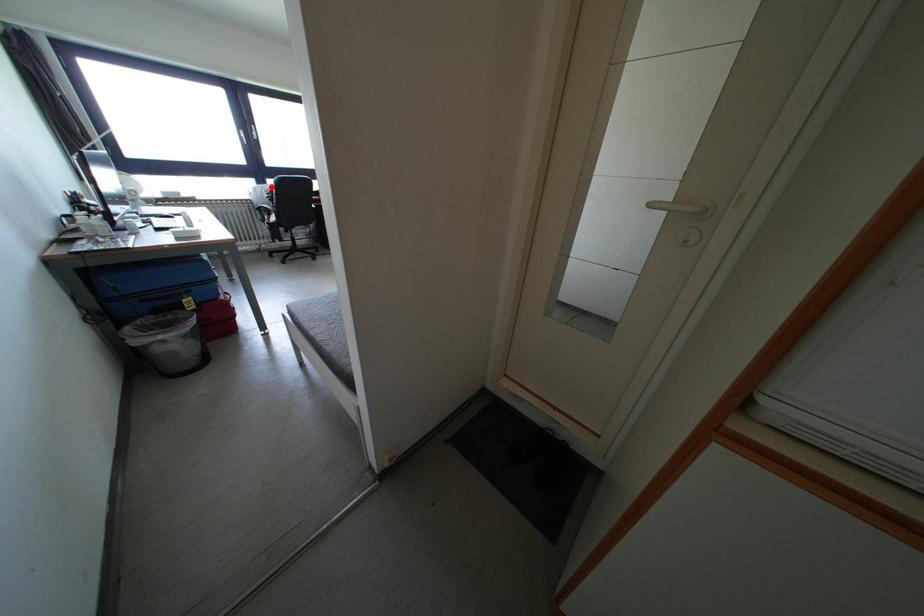
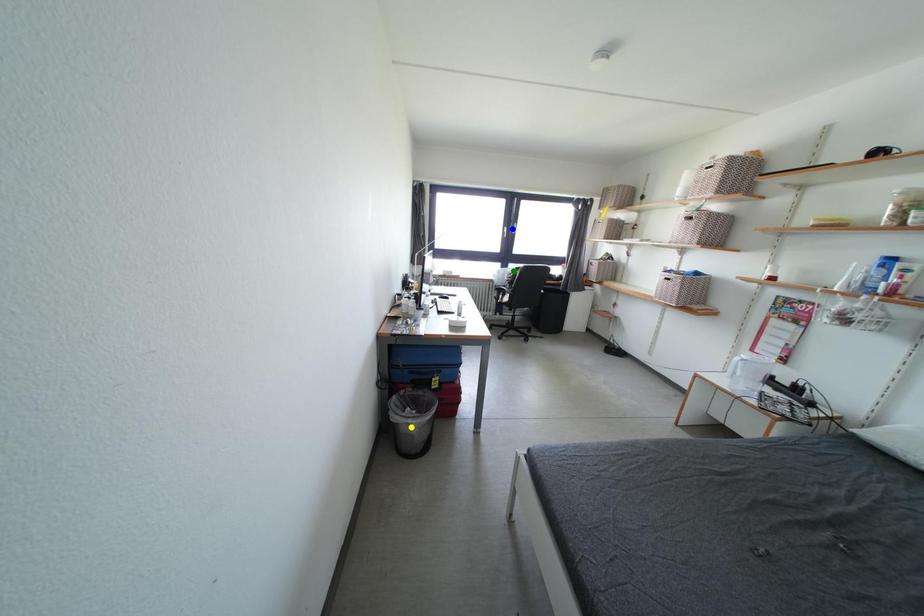
Question: I am providing you with two images of the same scene from different viewpoints. A red point is marked on the first image. You are given multiple points on the second image. Which mark in image 2 goes with the point in image 1?

Choices:
 (A) green point
 (B) blue point
 (C) yellow point

Answer: (A)